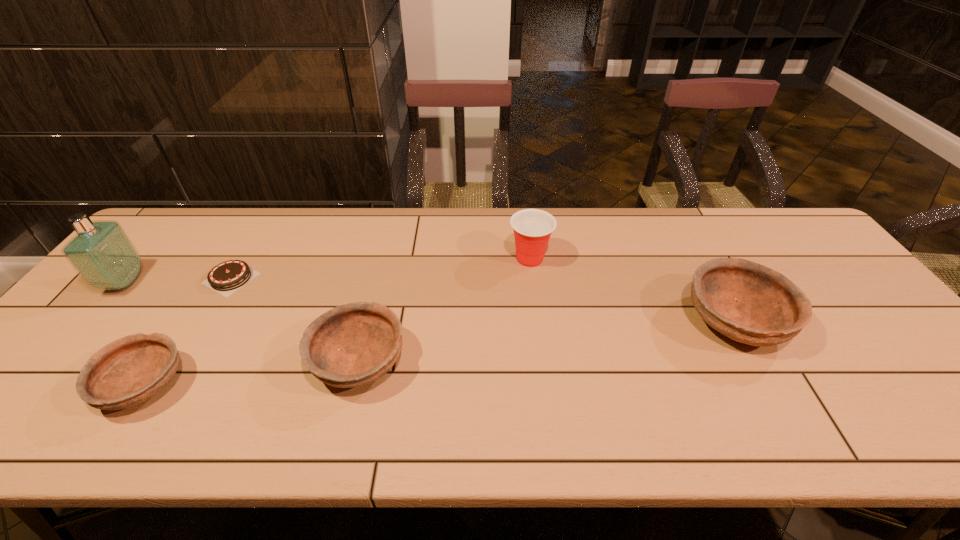
Find the location of a particular element. This screenshot has height=540, width=960. free region that satisfies the following two spatial constraints: 1. on the front label of the perfume; 2. on the back side of the fifth tallest object is located at coordinates (36, 386).

At what (x,y) coordinates should I click in order to perform the action: click on vacant space that satisfies the following two spatial constraints: 1. on the front side of the fifth object from left to right; 2. on the right side of the rightmost object. Please return your answer as a coordinate pair (x, y). This screenshot has height=540, width=960. Looking at the image, I should click on (538, 320).

Where is `free space that satisfies the following two spatial constraints: 1. on the front label of the rightmost object; 2. on the left side of the leftmost object`? free space that satisfies the following two spatial constraints: 1. on the front label of the rightmost object; 2. on the left side of the leftmost object is located at coordinates (92, 320).

Where is `blank space that satisfies the following two spatial constraints: 1. on the front label of the rightmost object; 2. on the right side of the leftmost object`? This screenshot has height=540, width=960. blank space that satisfies the following two spatial constraints: 1. on the front label of the rightmost object; 2. on the right side of the leftmost object is located at coordinates (92, 320).